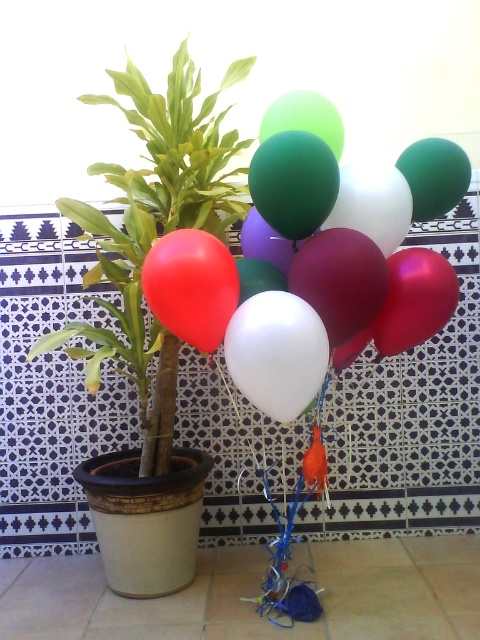
You are arranging decorations for a party and need to know the position of the balloons. Which balloon is closer to you, the matte red balloon at left or the matte white balloon at center?

The matte white balloon at center is closer to you because the matte red balloon at left is behind it.

You are standing in front of the decorative arrangement against the tiled wall. You see a point marked at coordinates (155, 227). Which object from the scene is located at that point?

The point at coordinates (155, 227) marks the green matte plant at left.

You are trying to fit both the green matte plant at left and the matte red balloon at left into a rectangular box. The box can only accommodate items up to the size of the larger object. Which object determines the minimum required box width?

The green matte plant at left has a larger width than the matte red balloon at left, so the box must be at least as wide as the green matte plant at left to fit both items.